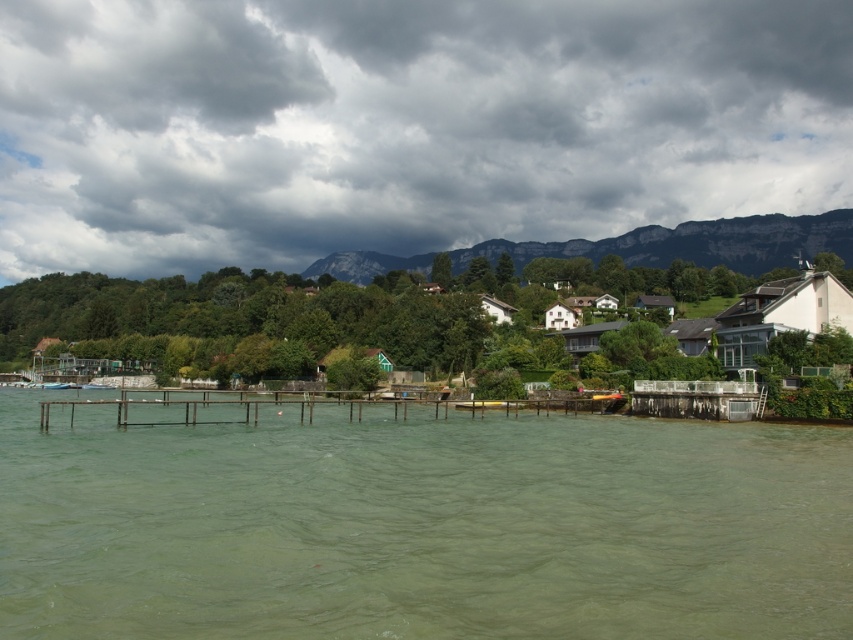
Locate an element on the screen. This screenshot has height=640, width=853. rugged stone mountain at upper center is located at coordinates (692, 243).

Is point (590, 257) positioned after point (544, 417)?

Yes, point (590, 257) is behind point (544, 417).

The height and width of the screenshot is (640, 853). I want to click on rugged stone mountain at upper center, so click(692, 243).

Between green murky water at center and rugged stone mountain at upper center, which one has less height?

green murky water at center

Who is taller, green murky water at center or rugged stone mountain at upper center?

rugged stone mountain at upper center is taller.

Measure the distance between green murky water at center and camera.

green murky water at center is 14.83 meters away from camera.

At what (x,y) coordinates should I click in order to perform the action: click on green murky water at center. Please return your answer as a coordinate pair (x, y). Looking at the image, I should click on (421, 525).

Which is behind, point (45, 170) or point (258, 408)?

The point (45, 170) is behind.

Where is `cloudy sky at upper center`? The image size is (853, 640). cloudy sky at upper center is located at coordinates (403, 125).

The width and height of the screenshot is (853, 640). Find the location of `cloudy sky at upper center`. cloudy sky at upper center is located at coordinates (403, 125).